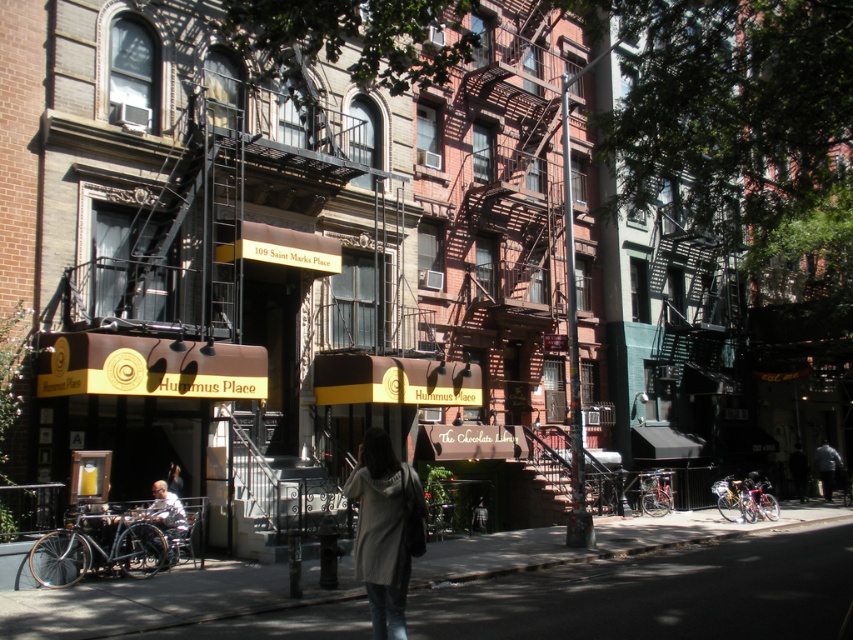
Looking at this image, is knit sweater at center closer to camera compared to white fabric shirt at lower left?

Yes.

Does point (392, 589) come closer to viewer compared to point (173, 509)?

Yes, it is.

The width and height of the screenshot is (853, 640). I want to click on knit sweater at center, so click(383, 529).

Is smooth asphalt sidewalk at center shorter than white fabric shirt at lower left?

In fact, smooth asphalt sidewalk at center may be taller than white fabric shirt at lower left.

Does smooth asphalt sidewalk at center appear over white fabric shirt at lower left?

No, smooth asphalt sidewalk at center is not above white fabric shirt at lower left.

Does point (444, 612) lie behind point (171, 540)?

No, it is in front of (171, 540).

The width and height of the screenshot is (853, 640). In order to click on smooth asphalt sidewalk at center in this screenshot , I will do `click(637, 579)`.

Between smooth asphalt sidewalk at center and dark gray fabric jacket at lower right, which one appears on the left side from the viewer's perspective?

From the viewer's perspective, smooth asphalt sidewalk at center appears more on the left side.

Between smooth asphalt sidewalk at center and dark gray fabric jacket at lower right, which one is positioned lower?

Positioned lower is dark gray fabric jacket at lower right.

Image resolution: width=853 pixels, height=640 pixels. I want to click on smooth asphalt sidewalk at center, so click(637, 579).

You are a GUI agent. You are given a task and a screenshot of the screen. Output one action in this format:
    pyautogui.click(x=<x>, y=<y>)
    Task: Click on the smooth asphalt sidewalk at center
    
    Given the screenshot: What is the action you would take?
    pyautogui.click(x=637, y=579)